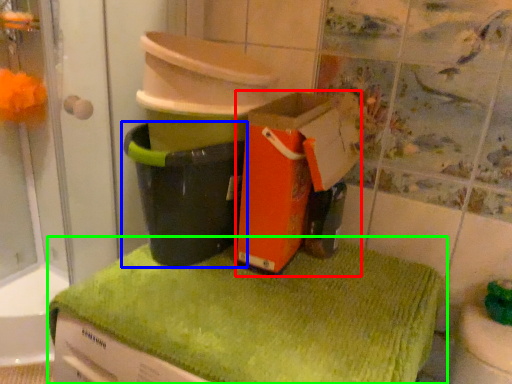
Question: Which is nearer to the cardboard box (highlighted by a red box)? waste container (highlighted by a blue box) or bath towel (highlighted by a green box).

Choices:
 (A) waste container
 (B) bath towel

Answer: (A)